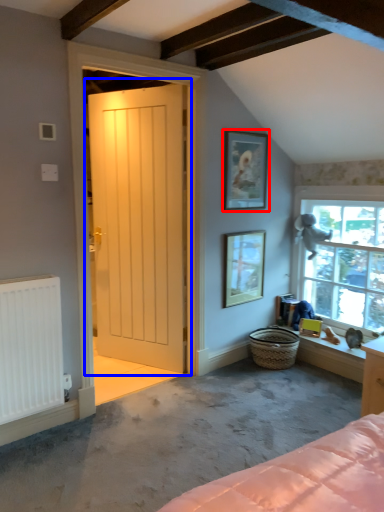
Question: Which object appears farthest to the camera in this image, picture frame (highlighted by a red box) or door (highlighted by a blue box)?

Choices:
 (A) picture frame
 (B) door

Answer: (A)